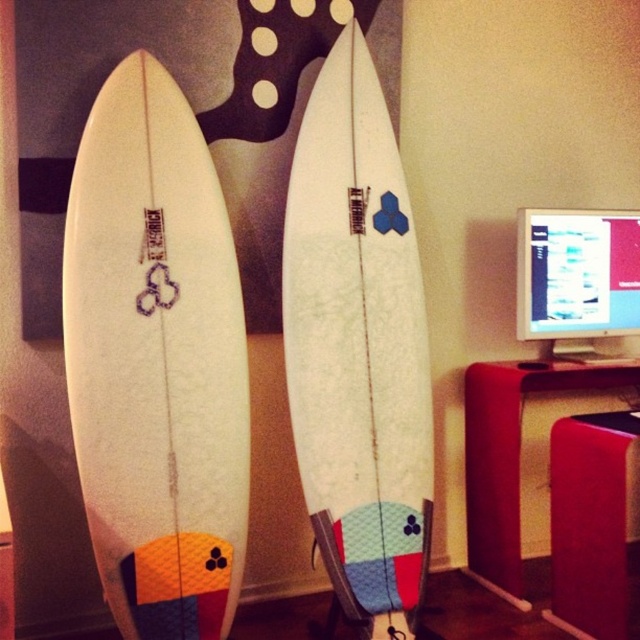
Does white matte surfboard at center have a lesser height compared to matte red stool at lower right?

Incorrect, white matte surfboard at center's height does not fall short of matte red stool at lower right's.

Does white matte surfboard at center have a greater height compared to matte red stool at lower right?

Indeed, white matte surfboard at center has a greater height compared to matte red stool at lower right.

Describe the element at coordinates (358, 348) in the screenshot. I see `white matte surfboard at center` at that location.

Locate an element on the screen. white matte surfboard at center is located at coordinates (358, 348).

Is the position of matte red desk at lower right less distant than that of matte white monitor at upper right?

Yes, it is.

Is matte red desk at lower right thinner than matte white monitor at upper right?

No.

Image resolution: width=640 pixels, height=640 pixels. Find the location of `matte red desk at lower right`. matte red desk at lower right is located at coordinates (524, 460).

Which is in front, point (131, 500) or point (388, 611)?

Positioned in front is point (131, 500).

Identify the location of white matte surfboard at left. (156, 360).